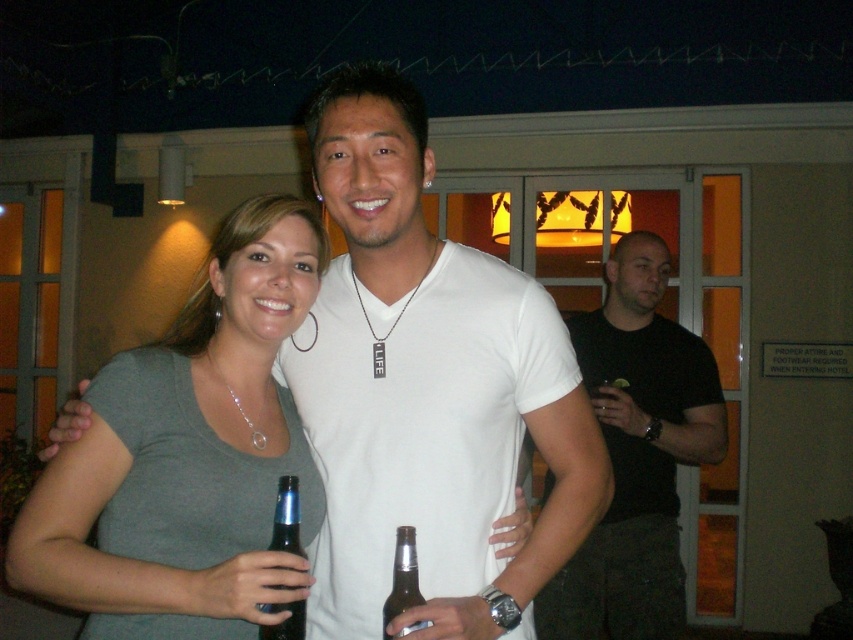
Based on the scene description, can you determine which object is taller between the gray matte shirt at center and the blue glass bottle at center?

The gray matte shirt at center is much taller than the blue glass bottle at center.

You are standing in front of the scene and want to take a photo. You notice two points marked in the image. The first point is at coordinates point (235, 253) and the second is at point (277, 536). Which point is closer to your camera?

Point (235, 253) is closer to the camera than point (277, 536).